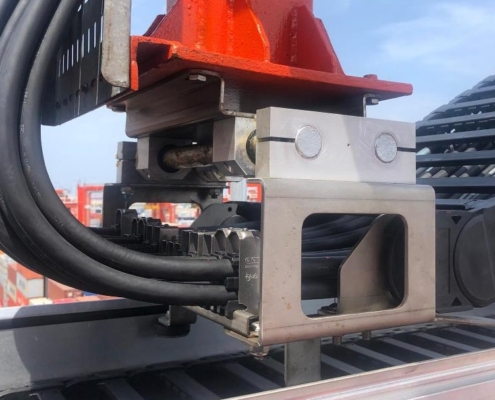
Identify the location of black cables. (140, 262), (141, 285).